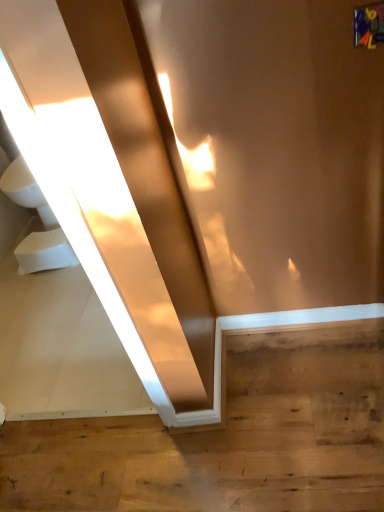
Question: Would you say white foam toilet bowl at lower left is inside or outside wooden floor at lower right?

Choices:
 (A) inside
 (B) outside

Answer: (B)

Question: From the image's perspective, is white foam toilet bowl at lower left located above or below wooden floor at lower right?

Choices:
 (A) below
 (B) above

Answer: (B)

Question: Considering the real-world distances, which object is farthest from the white foam toilet bowl at lower left?

Choices:
 (A) wooden floor at lower right
 (B) white glossy sink at left

Answer: (A)

Question: Estimate the real-world distances between objects in this image. Which object is closer to the white foam toilet bowl at lower left?

Choices:
 (A) wooden floor at lower right
 (B) white glossy sink at left

Answer: (B)